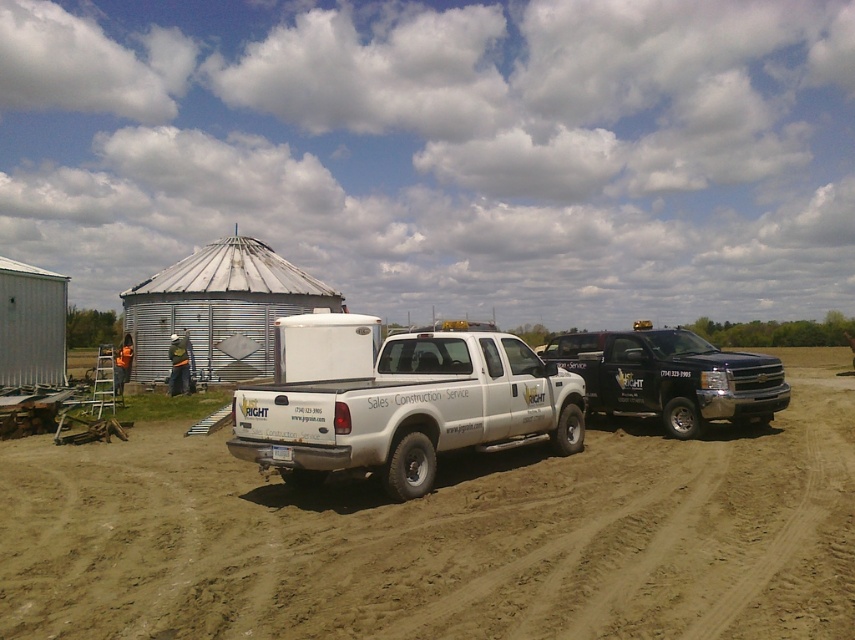
Is white matte truck at center wider than black glossy truck at right?

Indeed, white matte truck at center has a greater width compared to black glossy truck at right.

From the picture: Does white matte truck at center have a greater height compared to black glossy truck at right?

Yes, white matte truck at center is taller than black glossy truck at right.

Between point (304, 326) and point (579, 372), which one is positioned in front?

Point (579, 372)

Where is `white matte truck at center`? Image resolution: width=855 pixels, height=640 pixels. white matte truck at center is located at coordinates (397, 400).

Can you confirm if dirt field at center is wider than white matte truck at center?

Correct, the width of dirt field at center exceeds that of white matte truck at center.

Is point (563, 472) closer to camera compared to point (293, 321)?

Yes, it is in front of point (293, 321).

Find the location of `dirt field at center`. dirt field at center is located at coordinates (446, 536).

Is the position of dirt field at center less distant than that of black glossy truck at right?

Yes, it is in front of black glossy truck at right.

Who is positioned more to the left, dirt field at center or black glossy truck at right?

dirt field at center

Is point (806, 374) farther from viewer compared to point (646, 380)?

That is True.

At what (x,y) coordinates should I click in order to perform the action: click on dirt field at center. Please return your answer as a coordinate pair (x, y). The width and height of the screenshot is (855, 640). Looking at the image, I should click on (446, 536).